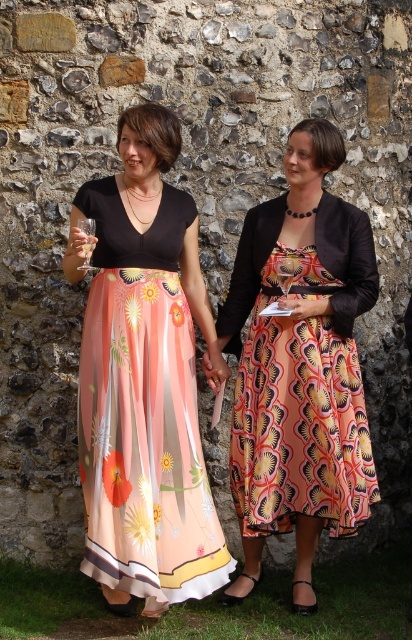
Question: Where is matte black dress at center located in relation to clear glass wine glass at left in the image?

Choices:
 (A) left
 (B) right

Answer: (B)

Question: Which point is closer to the camera?

Choices:
 (A) (81, 220)
 (B) (280, 282)
 (C) (145, 346)

Answer: (C)

Question: Is matte black dress at center above clear glass wine glass at left?

Choices:
 (A) no
 (B) yes

Answer: (A)

Question: Which object appears farthest from the camera in this image?

Choices:
 (A) clear glass wine glass at left
 (B) matte floral skirt at center

Answer: (A)

Question: Which object is closer to the camera taking this photo?

Choices:
 (A) clear glass wine glass at left
 (B) matte floral skirt at center
 (C) matte black dress at center

Answer: (B)

Question: Can you confirm if matte floral skirt at center is positioned above clear glass wine glass at center?

Choices:
 (A) no
 (B) yes

Answer: (A)